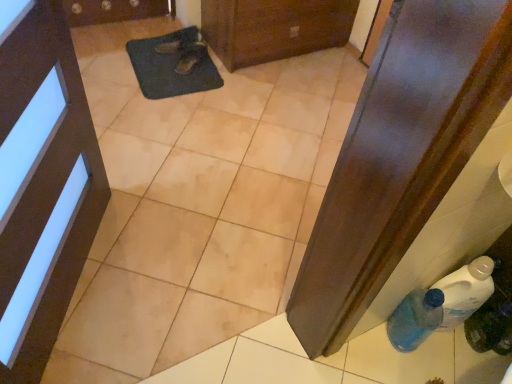
Where is `empty space that is in between matte black door at upper left, marked as the 2th door in a back-to-front arrangement, and blue translucent bottle at lower right, the 2th bottle positioned from the right`? The height and width of the screenshot is (384, 512). empty space that is in between matte black door at upper left, marked as the 2th door in a back-to-front arrangement, and blue translucent bottle at lower right, the 2th bottle positioned from the right is located at coordinates (209, 306).